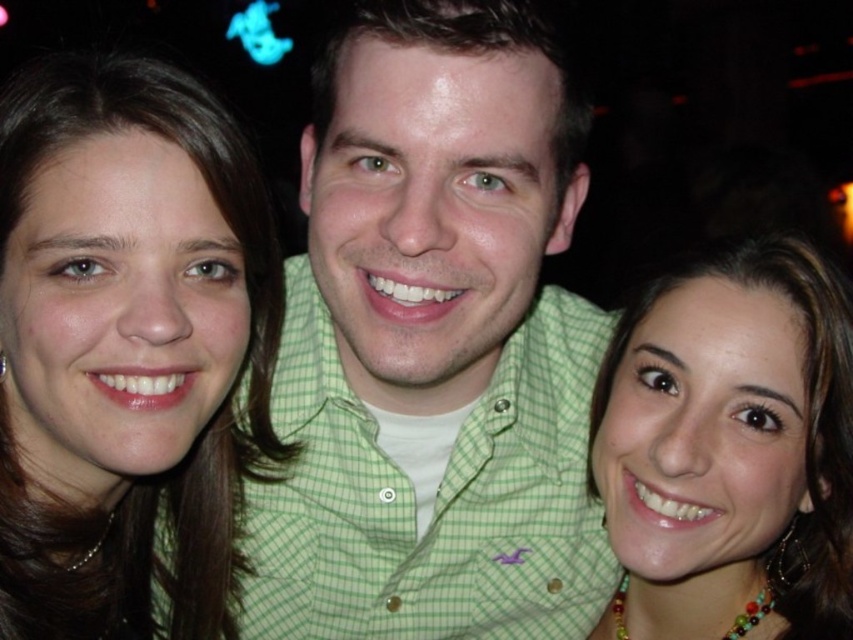
You are a photographer adjusting the framing of the image. You need to ensure that both the matte brown hair at center and the matte gold necklace at lower right are fully visible. Which object requires more horizontal space in the frame?

The matte brown hair at center requires more horizontal space in the frame because its width is larger than the matte gold necklace at lower right.

You are a photographer adjusting the camera focus. You notice the green checkered shirt at center and the matte gold necklace at lower right in your viewfinder. Which object should you focus on first if you want to ensure both are in focus, considering their sizes?

The green checkered shirt at center is taller than matte gold necklace at lower right, so focusing on the larger object first will help ensure both are in focus.